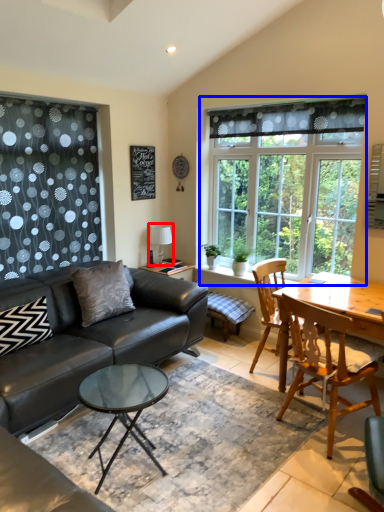
Question: Which object is further to the camera taking this photo, lamp (highlighted by a red box) or window (highlighted by a blue box)?

Choices:
 (A) lamp
 (B) window

Answer: (A)